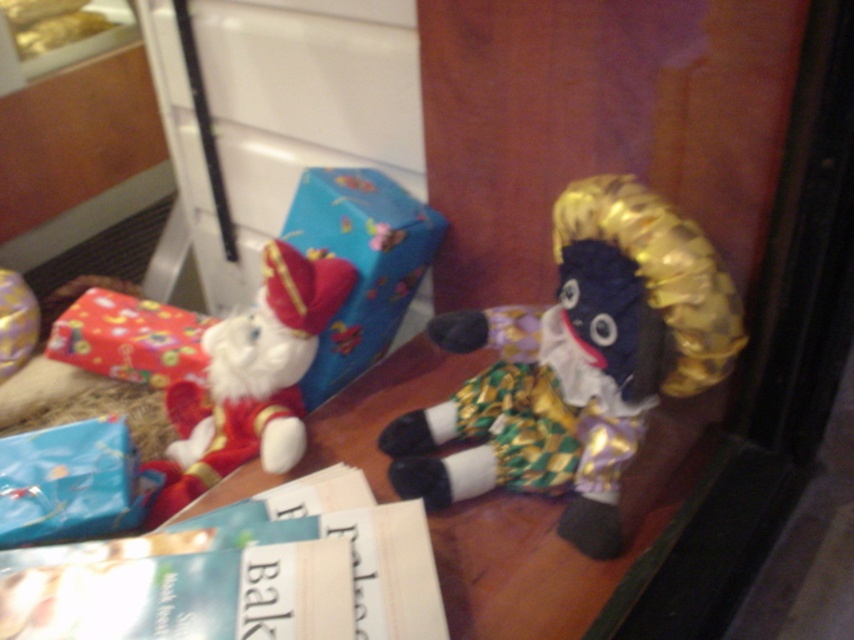
Question: Which object is positioned farthest from the blue shiny wrapping paper at lower left?

Choices:
 (A) gold textured wig at upper right
 (B) white plush santa at left
 (C) shiny red wrapping paper at left

Answer: (A)

Question: Can you confirm if white plush santa at left is positioned to the right of shiny blue wrapping paper at center?

Choices:
 (A) no
 (B) yes

Answer: (A)

Question: Estimate the real-world distances between objects in this image. Which object is farther from the white plush santa at left?

Choices:
 (A) shiny red wrapping paper at left
 (B) gold textured wig at upper right

Answer: (B)

Question: Which of the following is the farthest from the observer?

Choices:
 (A) (57, 445)
 (B) (305, 232)
 (C) (97, 369)
 (D) (633, 296)

Answer: (C)

Question: Is shiny blue wrapping paper at center wider than shiny red wrapping paper at left?

Choices:
 (A) yes
 (B) no

Answer: (B)

Question: Does gold textured wig at upper right have a smaller size compared to blue shiny wrapping paper at lower left?

Choices:
 (A) yes
 (B) no

Answer: (B)